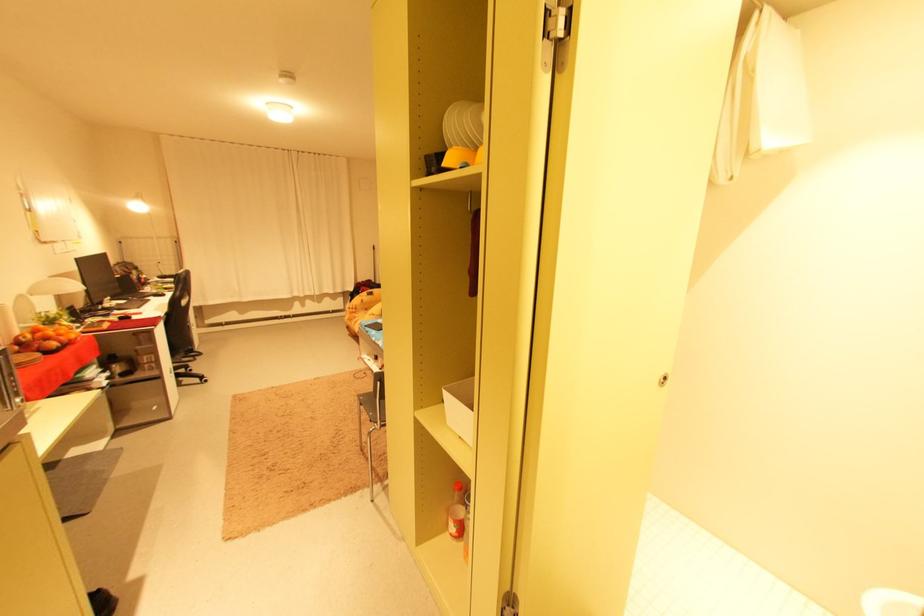
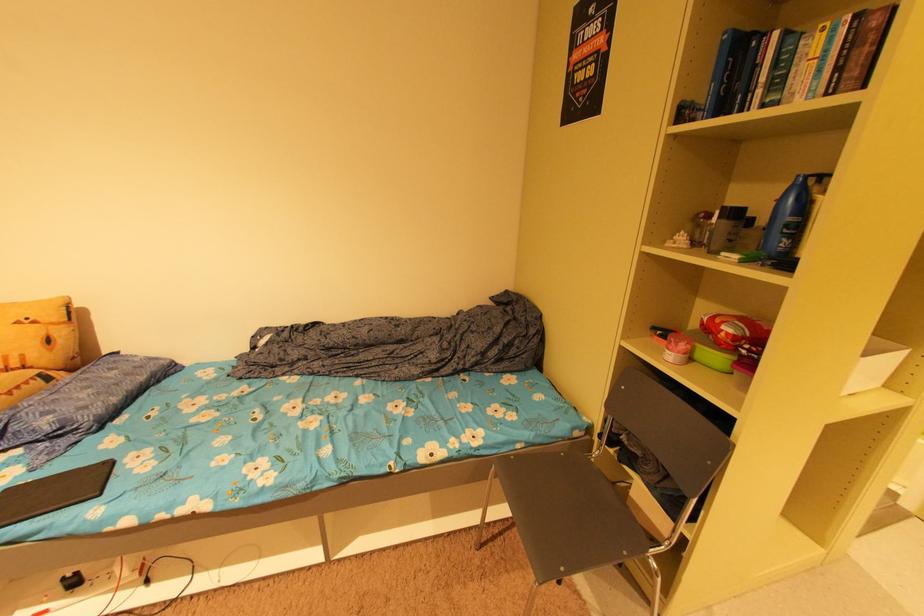
Where in the second image is the point corresponding to [378,415] from the first image?

(633, 554)